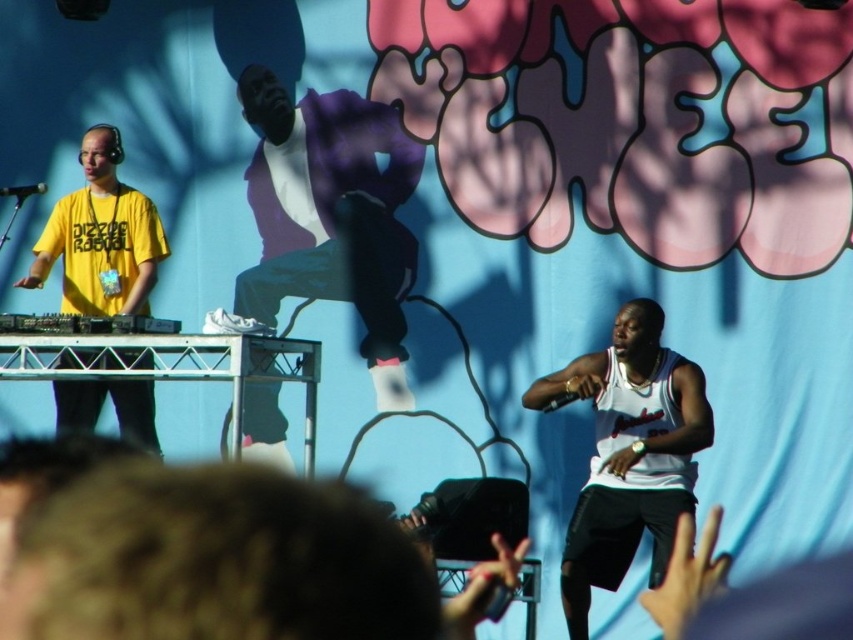
Question: Is purple cotton jacket at center positioned at the back of yellow matte t-shirt at left?

Choices:
 (A) no
 (B) yes

Answer: (B)

Question: Is the position of white jersey at center less distant than that of black plastic turntable at left?

Choices:
 (A) no
 (B) yes

Answer: (A)

Question: Among these points, which one is farthest from the camera?

Choices:
 (A) (129, 412)
 (B) (103, 326)

Answer: (A)

Question: Does purple cotton jacket at center appear on the left side of black plastic turntable at left?

Choices:
 (A) yes
 (B) no

Answer: (B)

Question: Which of these objects is positioned closest to the white jersey at center?

Choices:
 (A) purple cotton jacket at center
 (B) yellow matte t-shirt at left
 (C) black plastic turntable at left

Answer: (C)

Question: Which object is closer to the camera taking this photo?

Choices:
 (A) yellow matte t-shirt at left
 (B) black plastic turntable at left
 (C) purple cotton jacket at center

Answer: (B)